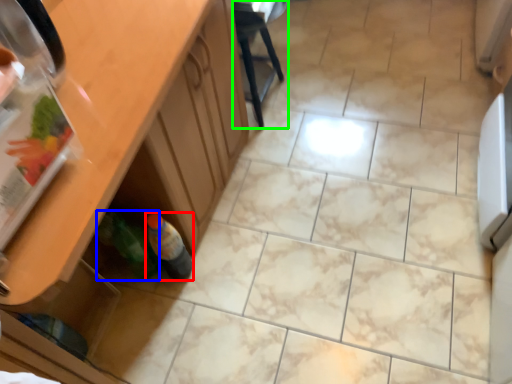
Question: Considering the real-world distances, which object is farthest from bottle (highlighted by a red box)? bottle (highlighted by a blue box) or chair (highlighted by a green box)?

Choices:
 (A) bottle
 (B) chair

Answer: (B)